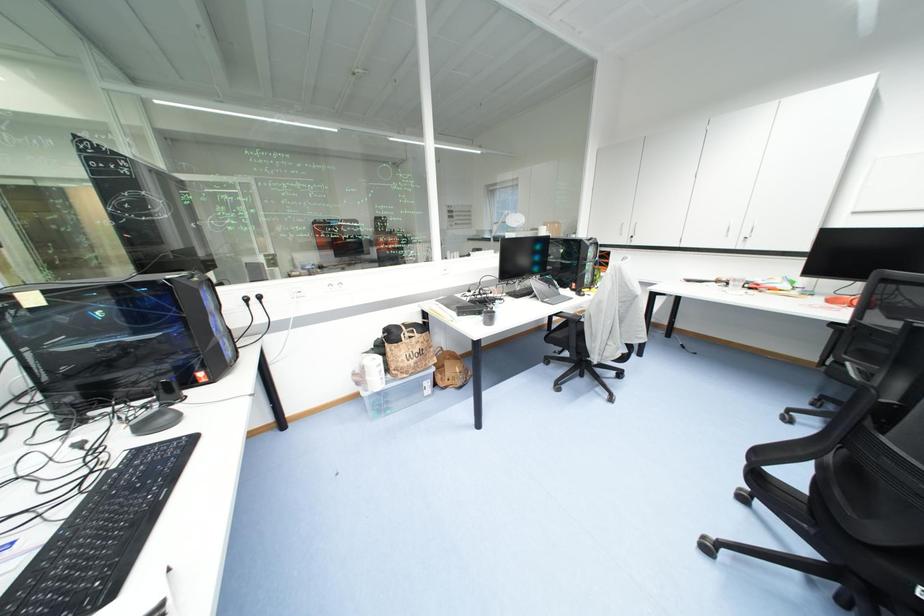
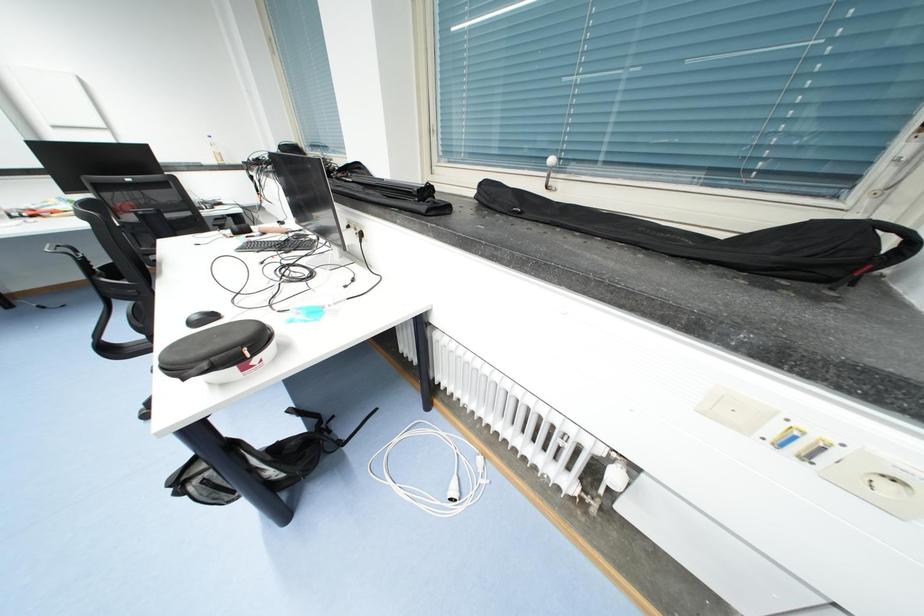
How did the camera likely rotate?

The camera's rotation is toward right-down.